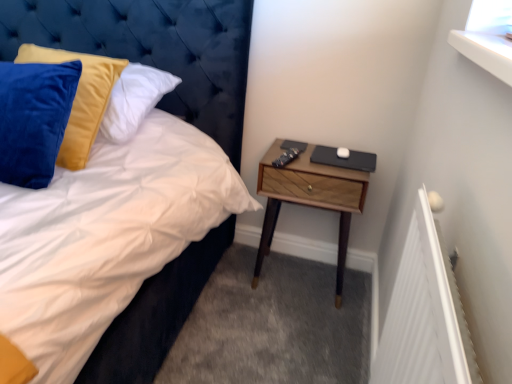
Question: Is velvet blue headboard at upper left to the left of wooden nightstand at right from the viewer's perspective?

Choices:
 (A) no
 (B) yes

Answer: (B)

Question: Does velvet blue headboard at upper left lie in front of wooden nightstand at right?

Choices:
 (A) yes
 (B) no

Answer: (A)

Question: Can we say velvet blue headboard at upper left lies outside wooden nightstand at right?

Choices:
 (A) no
 (B) yes

Answer: (B)

Question: Considering the relative sizes of velvet blue headboard at upper left and wooden nightstand at right in the image provided, is velvet blue headboard at upper left bigger than wooden nightstand at right?

Choices:
 (A) yes
 (B) no

Answer: (A)

Question: From the image's perspective, does velvet blue headboard at upper left appear lower than wooden nightstand at right?

Choices:
 (A) no
 (B) yes

Answer: (A)

Question: Is velvet blue headboard at upper left positioned with its back to wooden nightstand at right?

Choices:
 (A) yes
 (B) no

Answer: (B)

Question: Is wooden nightstand at right to the left of velvet blue headboard at upper left from the viewer's perspective?

Choices:
 (A) yes
 (B) no

Answer: (B)

Question: From the image's perspective, does wooden nightstand at right appear higher than velvet blue headboard at upper left?

Choices:
 (A) yes
 (B) no

Answer: (B)

Question: Can you confirm if wooden nightstand at right is taller than velvet blue headboard at upper left?

Choices:
 (A) yes
 (B) no

Answer: (B)

Question: Is wooden nightstand at right wider than velvet blue headboard at upper left?

Choices:
 (A) yes
 (B) no

Answer: (B)

Question: Is wooden nightstand at right positioned behind velvet blue headboard at upper left?

Choices:
 (A) no
 (B) yes

Answer: (B)

Question: Are wooden nightstand at right and velvet blue headboard at upper left making contact?

Choices:
 (A) yes
 (B) no

Answer: (B)

Question: Is wooden nightstand at right inside the boundaries of velvet blue headboard at upper left, or outside?

Choices:
 (A) outside
 (B) inside

Answer: (A)